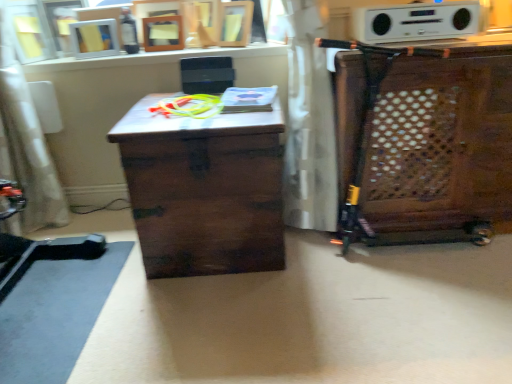
Question: Visually, is white matte picture frame at upper left positioned to the left or to the right of wooden cabinet at right?

Choices:
 (A) right
 (B) left

Answer: (B)

Question: From their relative heights in the image, would you say white matte picture frame at upper left is taller or shorter than wooden cabinet at right?

Choices:
 (A) tall
 (B) short

Answer: (B)

Question: Estimate the real-world distances between objects in this image. Which object is farther from the white matte picture frame at upper left?

Choices:
 (A) white fabric swivel chair at left
 (B) wooden cabinet at right
 (C) dark wood trunk at center
 (D) white plastic stereo at upper center
 (E) green rubber toy at center

Answer: (B)

Question: Based on their relative distances, which object is nearer to the white fabric swivel chair at left?

Choices:
 (A) green rubber toy at center
 (B) white plastic stereo at upper center
 (C) wooden cabinet at right
 (D) white matte picture frame at upper left
 (E) dark wood trunk at center

Answer: (D)